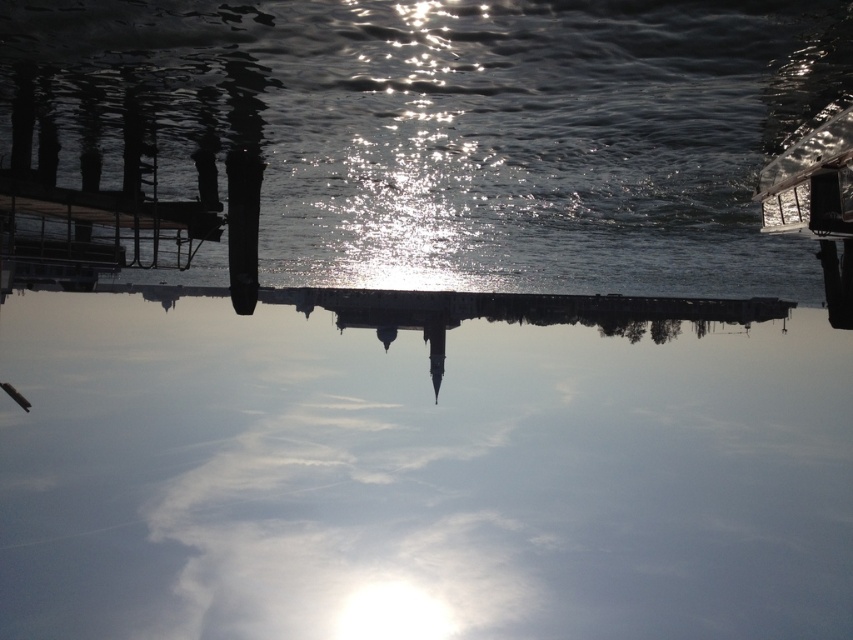
Between glistening water at center and dark wood dock at left, which one has more height?

dark wood dock at left

Describe the element at coordinates (456, 129) in the screenshot. I see `glistening water at center` at that location.

Is point (225, 104) farther from viewer compared to point (100, 241)?

No, (225, 104) is in front of (100, 241).

The height and width of the screenshot is (640, 853). Find the location of `glistening water at center`. glistening water at center is located at coordinates (456, 129).

Is transparent glass water at center thinner than dark wood dock at left?

In fact, transparent glass water at center might be wider than dark wood dock at left.

You are a GUI agent. You are given a task and a screenshot of the screen. Output one action in this format:
    pyautogui.click(x=<x>, y=<y>)
    Task: Click on the transparent glass water at center
    The width and height of the screenshot is (853, 640).
    Given the screenshot: What is the action you would take?
    (x=419, y=476)

Where is `transparent glass water at center`? transparent glass water at center is located at coordinates (419, 476).

Who is shorter, transparent glass water at center or glistening water at center?

With less height is glistening water at center.

Between transparent glass water at center and glistening water at center, which one appears on the left side from the viewer's perspective?

From the viewer's perspective, glistening water at center appears more on the left side.

Who is more forward, (408, 435) or (544, 208)?

Point (544, 208) is in front.

You are a GUI agent. You are given a task and a screenshot of the screen. Output one action in this format:
    pyautogui.click(x=<x>, y=<y>)
    Task: Click on the transparent glass water at center
    
    Given the screenshot: What is the action you would take?
    pyautogui.click(x=419, y=476)